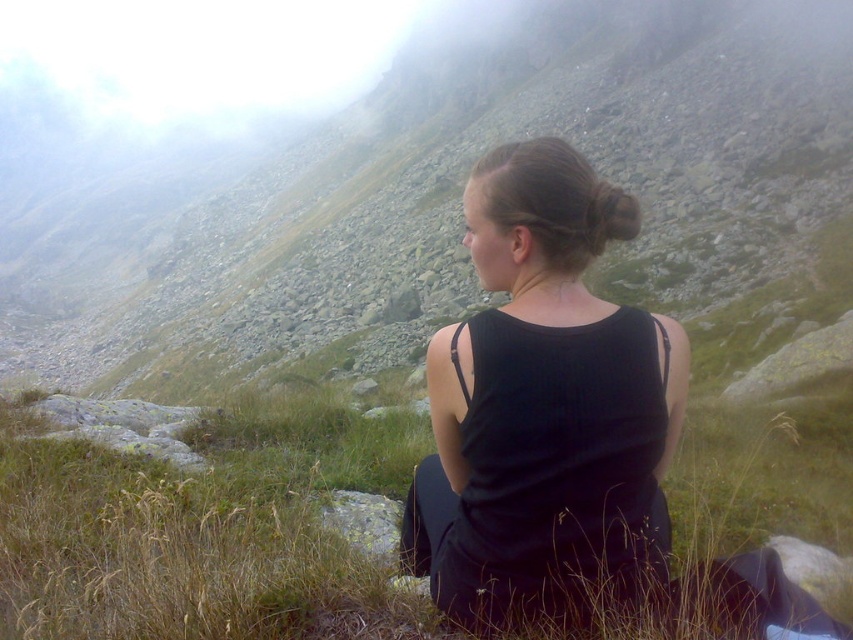
You are planning to set up a small campsite in this high altitude area. You have a tent that requires a flat area larger than the space taken by the green grass at center. Can you use the area where the black matte dress at center is located for your tent?

The green grass at center occupies less space than the black matte dress at center. Since the tent requires a flat area larger than the green grass at center, the area where the black matte dress at center is located has sufficient space to accommodate the tent.